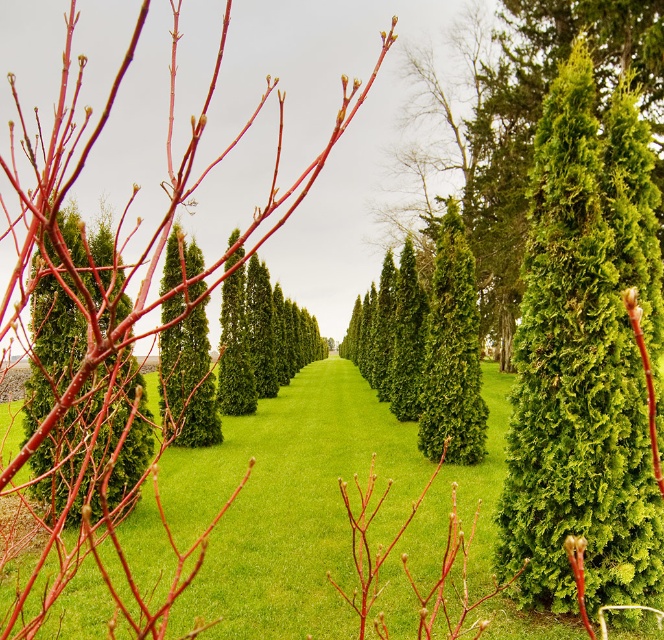
Based on the photo, can you confirm if green fuzzy shrub at right is wider than matte red shrub at left?

No.

Can you confirm if green fuzzy shrub at right is positioned to the right of matte red shrub at left?

Correct, you'll find green fuzzy shrub at right to the right of matte red shrub at left.

Image resolution: width=664 pixels, height=640 pixels. Describe the element at coordinates (584, 356) in the screenshot. I see `green fuzzy shrub at right` at that location.

Find the location of a particular element. green fuzzy shrub at right is located at coordinates (584, 356).

Which is more to the right, green grass at center or green textured shrub at center?

green grass at center

Based on the photo, is green grass at center to the left of green textured shrub at center from the viewer's perspective?

In fact, green grass at center is to the right of green textured shrub at center.

Is point (155, 400) less distant than point (203, 301)?

No, (155, 400) is behind (203, 301).

Find the location of a particular element. Image resolution: width=664 pixels, height=640 pixels. green grass at center is located at coordinates (288, 506).

Is matte red shrub at left positioned behind green textured shrub at center?

That is False.

Which of these two, matte red shrub at left or green textured shrub at center, stands taller?

matte red shrub at left

Who is more forward, [37,467] or [201,404]?

Point [37,467] is more forward.

Identify the location of matte red shrub at left. The width and height of the screenshot is (664, 640). [96, 440].